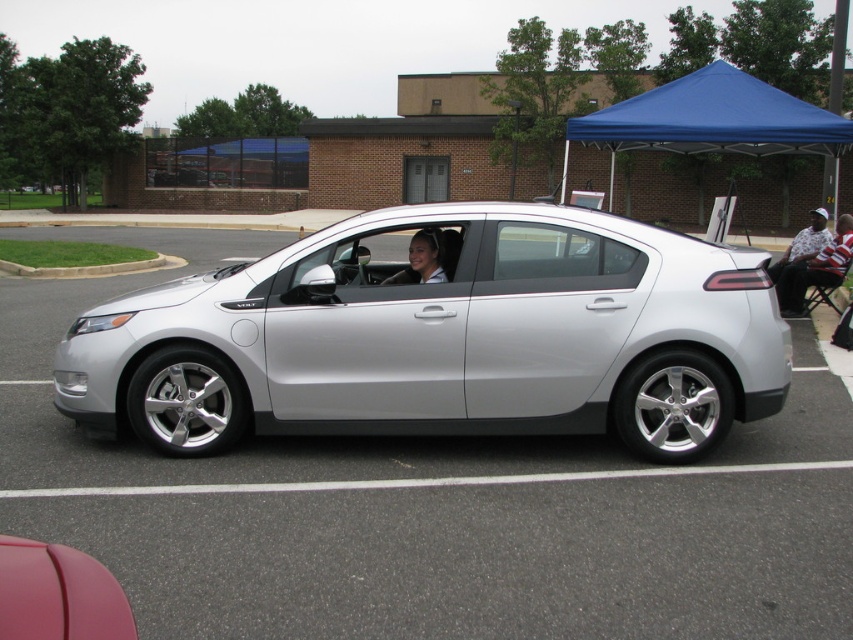
You are standing at the center of the parking lot and want to locate the metallic pink car at lower left. According to the coordinates given, where should you look relative to your position?

The metallic pink car at lower left is located at coordinates point (57,595), which means you should look towards the lower left direction from your current position at the center of the parking lot.

You are standing in the parking lot and notice the blue fabric canopy at upper right and the white shirt at right. Which object is taller?

The blue fabric canopy at upper right is taller than the white shirt at right.

You are standing outside the silver Chevrolet Volt parked in the parking lot. You notice a blue fabric canopy at upper right and a white shirt at right. Which object is closer to you from your current position?

The blue fabric canopy at upper right is closer to you because it is in front of the white shirt at right.